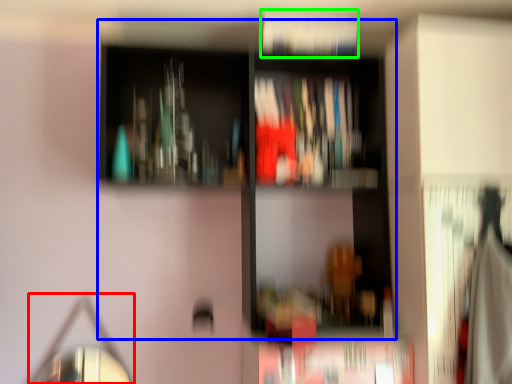
Question: Which object is the closest to the mirror (highlighted by a red box)? Choose among these: bookcase (highlighted by a blue box) or book (highlighted by a green box).

Choices:
 (A) bookcase
 (B) book

Answer: (A)